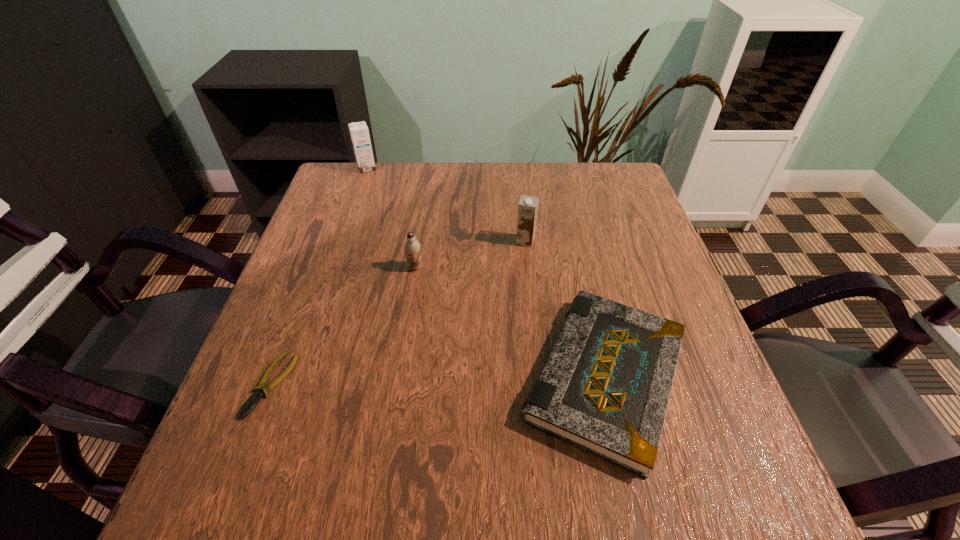
This screenshot has width=960, height=540. Identify the location of the farthest object. pyautogui.click(x=359, y=132).

Image resolution: width=960 pixels, height=540 pixels. Identify the location of the farthest chocolate milk. (359, 132).

Identify the location of the rightmost chocolate milk. The width and height of the screenshot is (960, 540). (528, 206).

The height and width of the screenshot is (540, 960). In order to click on the second farthest object in this screenshot , I will do `click(528, 206)`.

This screenshot has width=960, height=540. Find the location of `the third shortest object`. the third shortest object is located at coordinates (412, 247).

The height and width of the screenshot is (540, 960). Identify the location of the nearest chocolate milk. (412, 247).

At what (x,y) coordinates should I click in order to perform the action: click on the fourth tallest object. Please return your answer as a coordinate pair (x, y). The width and height of the screenshot is (960, 540). Looking at the image, I should click on (605, 386).

At what (x,y) coordinates should I click in order to perform the action: click on pliers. Please return your answer as a coordinate pair (x, y). Looking at the image, I should click on (252, 402).

At what (x,y) coordinates should I click in order to perform the action: click on free space located on the right of the farthest chocolate milk. Please return your answer as a coordinate pair (x, y). Image resolution: width=960 pixels, height=540 pixels. Looking at the image, I should click on (474, 168).

In order to click on vacant space located 0.290m on the back of the second nearest chocolate milk in this screenshot , I will do `click(517, 171)`.